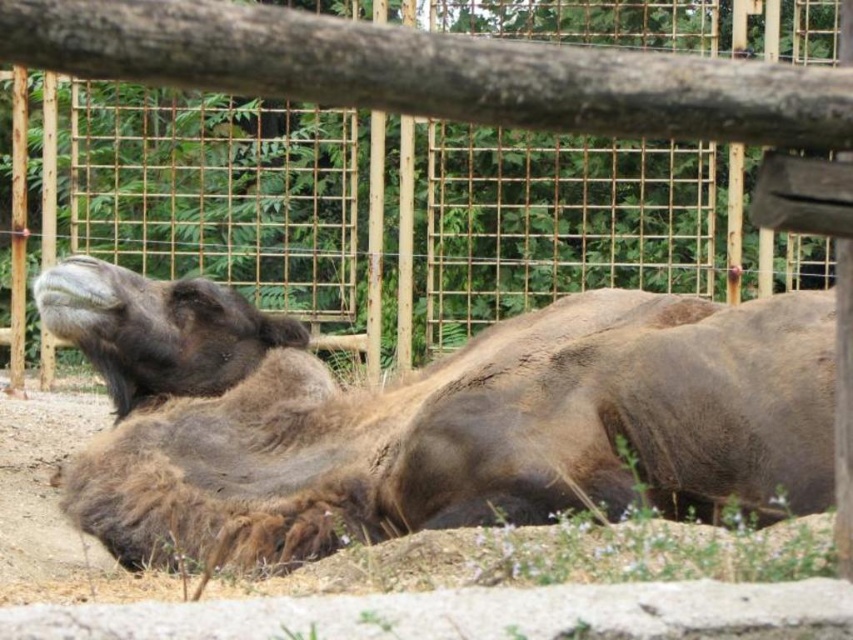
You are standing in front of the camel enclosure at the zoo. You notice two points marked on the ground at coordinates point [392,506] and point [4,38]. If you want to place a small water bowl closer to the camera, which point should you choose?

Point [392,506] is further to the camera than point [4,38], so you should place the water bowl at point [4,38] to be closer to the camera.

Looking at this image, you are standing in front of the zoo enclosure and want to take a photo of the brown fuzzy camel at center. If your camera has a minimum focus distance of 3 meters, will you be able to take a clear photo without moving closer?

The brown fuzzy camel at center is 3.30 meters from viewer. Since the minimum focus distance is 3 meters, the camel is within the camera range, so yes, you can take a clear photo without moving closer.

You are a zookeeper trying to determine if the brown fuzzy camel at center can fit through the wooden fence at upper center. Based on their sizes, can the camel pass through the fence?

The brown fuzzy camel at center might be wider than wooden fence at upper center, so it is possible that the camel cannot pass through the fence due to its width.